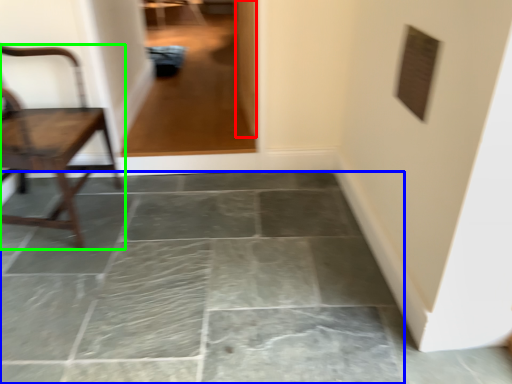
Question: Considering the real-world distances, which object is closest to glass door (highlighted by a red box)? concrete (highlighted by a blue box) or chair (highlighted by a green box).

Choices:
 (A) concrete
 (B) chair

Answer: (B)